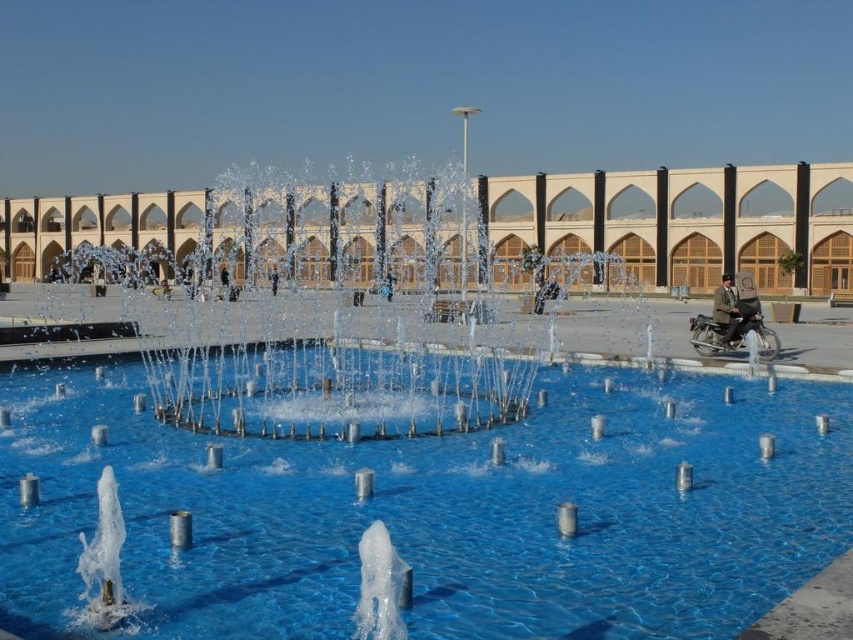
You are a photographer trying to capture the fountain and the objects at the right side. Since the shiny metallic motorcycle at right and the dark brown leather jacket at right are both on the right, which one can you fit more easily into your camera frame without moving the camera?

The shiny metallic motorcycle at right is thinner than the dark brown leather jacket at right, so it can be fit more easily into the camera frame without moving the camera.

You are standing at the entrance of the building and want to take a photo of the transparent glass swimming pool at center and the shiny metallic motorcycle at right. Which object should you point your camera towards first to capture both in the same frame?

You should point your camera towards the transparent glass swimming pool at center first because it is located below the shiny metallic motorcycle at right, so adjusting the angle to include both would require framing from the lower position upwards.

You are a maintenance worker needing to reach the dark brown leather jacket at right from the transparent glass swimming pool at center. Given that your maintenance cart can only travel 15 meters before needing a recharge, can you reach the jacket without needing to recharge?

The transparent glass swimming pool at center is 16.85 meters from the dark brown leather jacket at right. Since the distance exceeds the cart can travel before needing a recharge, you cannot reach the jacket without recharging first.